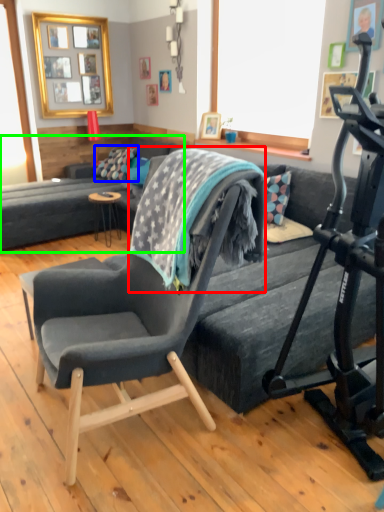
Question: Which is nearer to the blanket (highlighted by a red box)? pillow (highlighted by a blue box) or studio couch (highlighted by a green box).

Choices:
 (A) pillow
 (B) studio couch

Answer: (B)